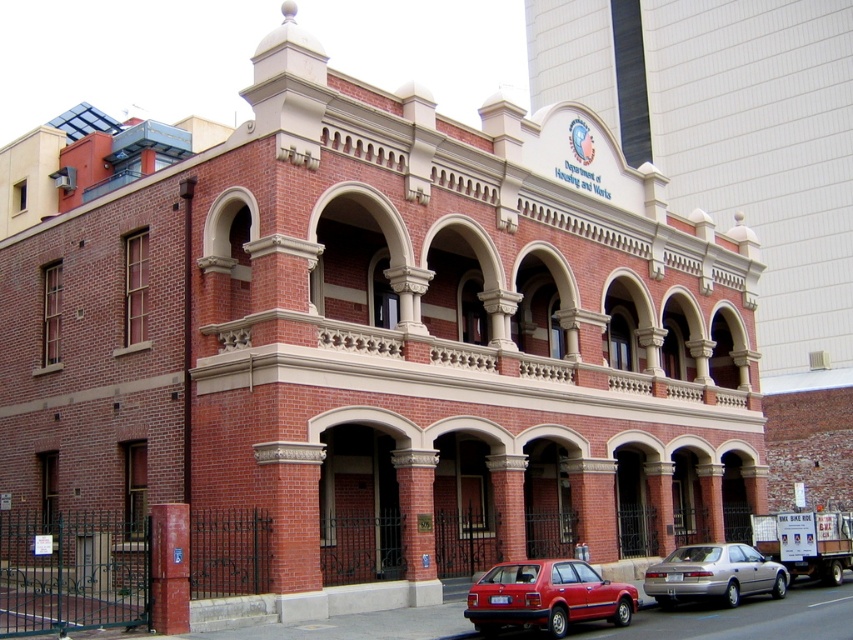
You are a delivery driver who needs to park your truck, which is 20 feet long, between the matte red sedan at lower center and the silver metallic sedan at lower right. Is there enough space for your truck to fit between them?

The distance between the matte red sedan at lower center and the silver metallic sedan at lower right is 23.69 feet. Since your truck is 20 feet long, there is enough space for it to fit between them.

You are a delivery person trying to park your vehicle in front of the Department of Housing and Works building. You see the matte red sedan at lower center and the brick pillar at center. Which object is closer to the entrance of the building?

The brick pillar at center is closer to the entrance of the Department of Housing and Works building because the matte red sedan at lower center is positioned to the right of it, meaning the pillar is between the sedan and the entrance.

You are a delivery driver who needs to park your truck between the matte red sedan at lower center and the brick pillar at center. Is there enough space for your truck, which is 6 meters long?

The matte red sedan at lower center is in front of the brick pillar at center, but the distance between them isn not specified in the objects description. Therefore, it is unclear if there is enough space for the truck.